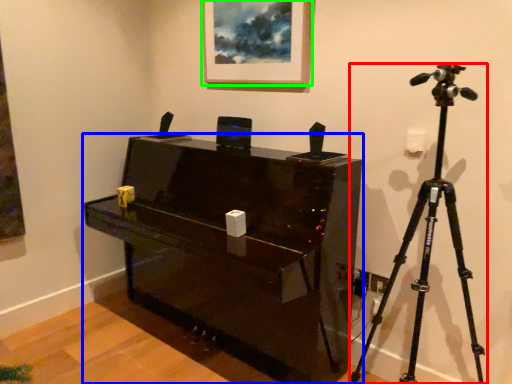
Question: Estimate the real-world distances between objects in this image. Which object is closer to tripod (highlighted by a red box), furniture (highlighted by a blue box) or picture frame (highlighted by a green box)?

Choices:
 (A) furniture
 (B) picture frame

Answer: (A)